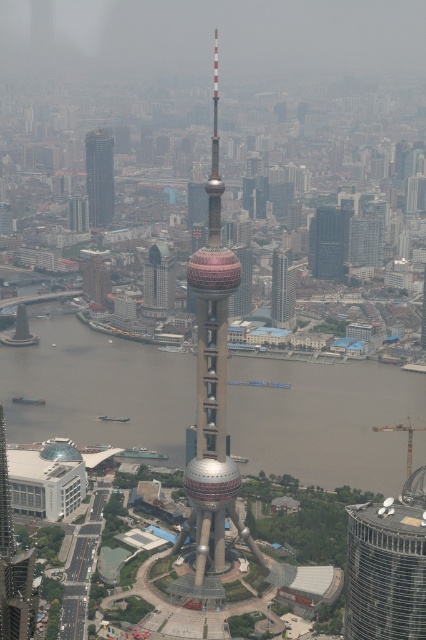
Can you confirm if matte glass building at center-left is smaller than matte brown building at center-left?

No, matte glass building at center-left is not smaller than matte brown building at center-left.

You are a GUI agent. You are given a task and a screenshot of the screen. Output one action in this format:
    pyautogui.click(x=<x>, y=<y>)
    Task: Click on the matte glass building at center-left
    
    Given the screenshot: What is the action you would take?
    pyautogui.click(x=158, y=280)

Find the location of a particular element. The width and height of the screenshot is (426, 640). matte glass building at center-left is located at coordinates (158, 280).

Where is `matte glass building at center-left`? matte glass building at center-left is located at coordinates (158, 280).

Does matte glass skyscraper at left have a lesser height compared to matte brown building at center-left?

No, matte glass skyscraper at left is not shorter than matte brown building at center-left.

Between matte glass skyscraper at left and matte brown building at center-left, which one is positioned higher?

Positioned higher is matte glass skyscraper at left.

Where is `matte glass skyscraper at left`? matte glass skyscraper at left is located at coordinates (100, 176).

Is dark gray glass skyscraper at center thinner than glassy silver skyscraper at center?

No, dark gray glass skyscraper at center is not thinner than glassy silver skyscraper at center.

Which is in front, point (317, 230) or point (282, 276)?

Point (282, 276) is in front.

From the picture: Who is more distant from viewer, (324, 252) or (288, 291)?

The point (324, 252) is behind.

You are a GUI agent. You are given a task and a screenshot of the screen. Output one action in this format:
    pyautogui.click(x=<x>, y=<y>)
    Task: Click on the dark gray glass skyscraper at center
    The width and height of the screenshot is (426, 640).
    Given the screenshot: What is the action you would take?
    pyautogui.click(x=328, y=241)